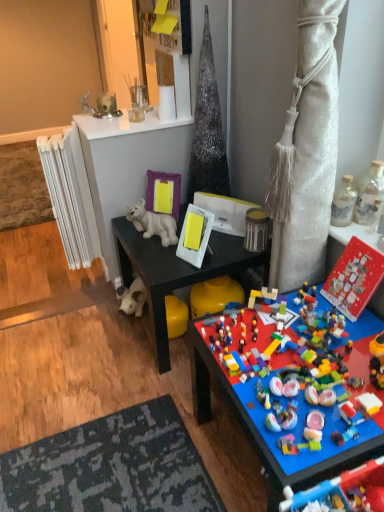
Locate an element on the screen. Image resolution: width=384 pixels, height=512 pixels. empty space that is ontop of multicolored plastic lego pieces at lower right, which is counted as the seventh toy, starting from the top (from a real-world perspective) is located at coordinates (304, 348).